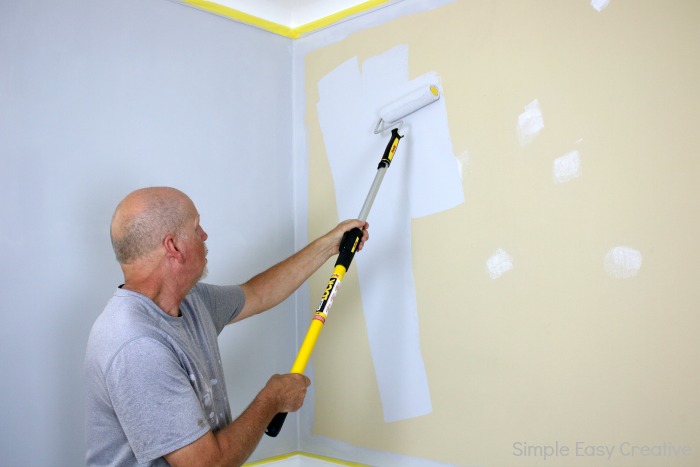
Image resolution: width=700 pixels, height=467 pixels. I want to click on tan colored wall, so click(547, 62).